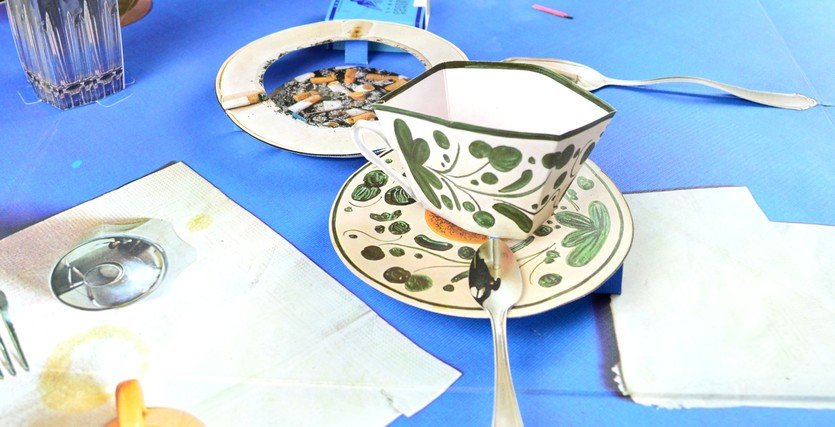
What are the coordinates of `dainty teacup handle` in the screenshot? It's located at (365, 147).